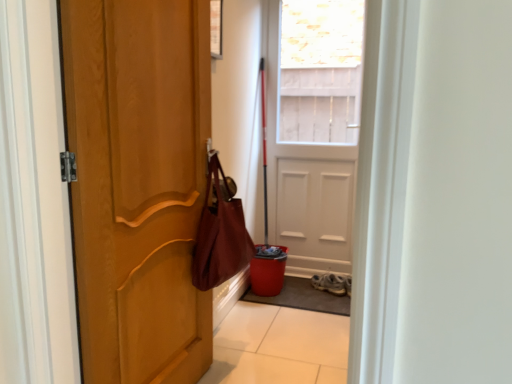
I want to click on free point behind white leather sneakers at lower center, so click(x=316, y=277).